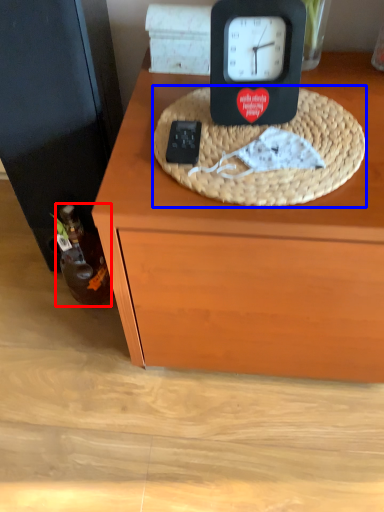
Question: Which object appears farthest to the camera in this image, bottle (highlighted by a red box) or basket (highlighted by a blue box)?

Choices:
 (A) bottle
 (B) basket

Answer: (A)